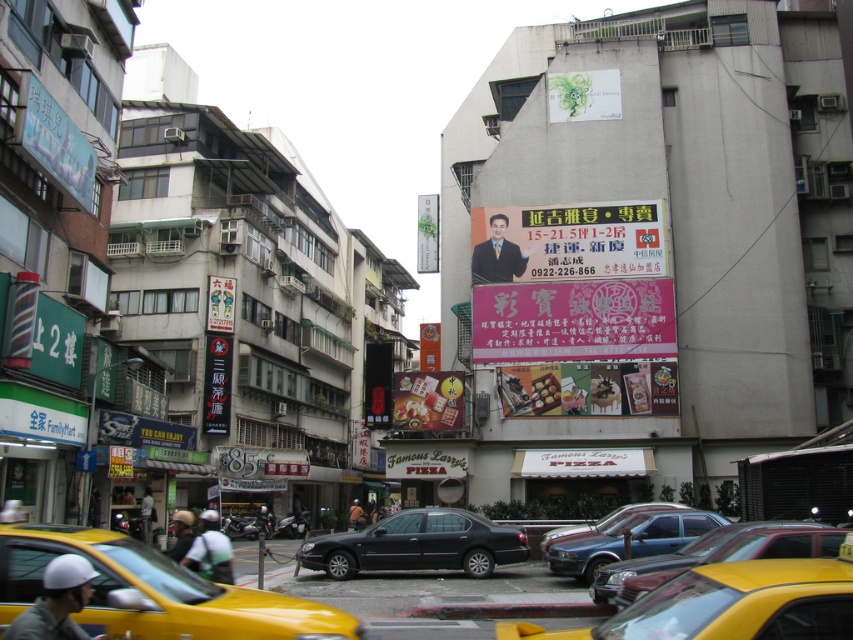
You are a pedestrian standing on the street and want to see the pink matte billboard at center clearly. However, there is a metallic silver sedan at center in your way. Based on the scene description, can you determine if the billboard is visible from your current position?

The metallic silver sedan at center is behind the pink matte billboard at center, so the billboard is visible from your current position as the sedan is not blocking it.

You are a delivery person trying to navigate through the narrow street. You notice a blue glossy signboard at upper left and a white cardboard sign at center. Which sign is wider?

The white cardboard sign at center is wider than the blue glossy signboard at upper left.